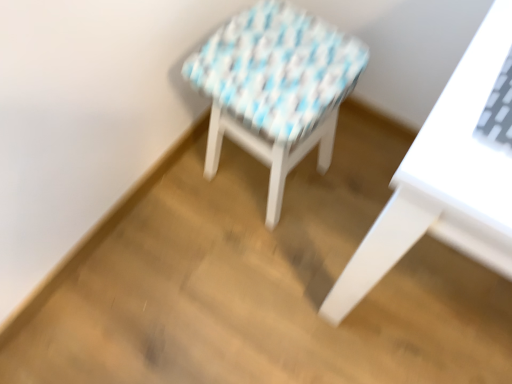
Image resolution: width=512 pixels, height=384 pixels. What are the coordinates of `white glossy table at right` in the screenshot? It's located at (449, 173).

The height and width of the screenshot is (384, 512). What do you see at coordinates (449, 173) in the screenshot?
I see `white glossy table at right` at bounding box center [449, 173].

Measure the distance between white glossy table at right and camera.

The distance of white glossy table at right from camera is 19.55 inches.

At what (x,y) coordinates should I click in order to perform the action: click on white woven stool at center. Please return your answer as a coordinate pair (x, y). Looking at the image, I should click on (275, 88).

This screenshot has width=512, height=384. Describe the element at coordinates (275, 88) in the screenshot. I see `white woven stool at center` at that location.

Find the location of a particular element. white glossy table at right is located at coordinates (449, 173).

Is white glossy table at right to the left or to the right of white woven stool at center in the image?

In the image, white glossy table at right appears on the right side of white woven stool at center.

Considering their positions, is white glossy table at right located in front of or behind white woven stool at center?

white glossy table at right is in front of white woven stool at center.

Does point (405, 242) come farther from viewer compared to point (283, 130)?

No.

From the image's perspective, relative to white woven stool at center, is white glossy table at right above or below?

white glossy table at right is situated lower than white woven stool at center in the image.

From a real-world perspective, is white glossy table at right above or below white woven stool at center?

white glossy table at right is situated higher than white woven stool at center in the real world.

Is white glossy table at right wider than white woven stool at center?

Correct, the width of white glossy table at right exceeds that of white woven stool at center.

Is white glossy table at right taller or shorter than white woven stool at center?

Considering their sizes, white glossy table at right has more height than white woven stool at center.

Which of these two, white glossy table at right or white woven stool at center, is smaller?

white woven stool at center is smaller.

From the picture: Is white glossy table at right located outside white woven stool at center?

Indeed, white glossy table at right is completely outside white woven stool at center.

Is white glossy table at right in contact with white woven stool at center?

There is a gap between white glossy table at right and white woven stool at center.

Could you tell me if white glossy table at right is facing white woven stool at center?

No, white glossy table at right is not aimed at white woven stool at center.

How different are the orientations of white glossy table at right and white woven stool at center in degrees?

83.3 degrees.

Locate an element on the screen. stool above the white glossy table at right (from the image's perspective) is located at coordinates (275, 88).

Is white woven stool at center to the left or to the right of white glossy table at right in the image?

white woven stool at center is to the left of white glossy table at right.

Based on the photo, is the depth of white woven stool at center greater than that of white glossy table at right?

Yes, the depth of white woven stool at center is greater than that of white glossy table at right.

Is point (258, 16) farther from viewer compared to point (359, 267)?

Yes, it is behind point (359, 267).

From the image's perspective, does white woven stool at center appear lower than white glossy table at right?

No, from the image's perspective, white woven stool at center is not beneath white glossy table at right.

From a real-world perspective, who is located lower, white woven stool at center or white glossy table at right?

In real-world perspective, white woven stool at center is lower.

Which of these two, white woven stool at center or white glossy table at right, is thinner?

With smaller width is white woven stool at center.

Between white woven stool at center and white glossy table at right, which one has more height?

white glossy table at right is taller.

Considering the sizes of objects white woven stool at center and white glossy table at right in the image provided, who is smaller, white woven stool at center or white glossy table at right?

white woven stool at center.

Could white glossy table at right be considered to be inside white woven stool at center?

That's incorrect, white glossy table at right is not inside white woven stool at center.

Would you say white woven stool at center is a long distance from white glossy table at right?

No, there isn't a large distance between white woven stool at center and white glossy table at right.

Is white woven stool at center oriented away from white glossy table at right?

No, white woven stool at center is not facing away from white glossy table at right.

Can you tell me how much white woven stool at center and white glossy table at right differ in facing direction?

83.3 degrees.

Locate an element on the screen. The height and width of the screenshot is (384, 512). stool below the white glossy table at right (from a real-world perspective) is located at coordinates (275, 88).

Locate an element on the screen. stool behind the white glossy table at right is located at coordinates (275, 88).

I want to click on stool that appears below the white glossy table at right (from a real-world perspective), so click(x=275, y=88).